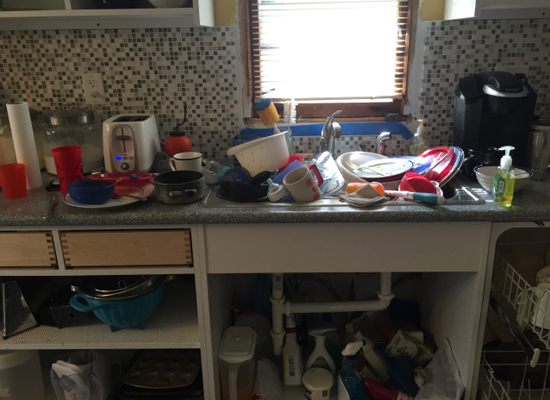
Locate an element on the screen. bowl is located at coordinates (257, 149), (82, 189), (389, 185), (343, 170), (128, 308).